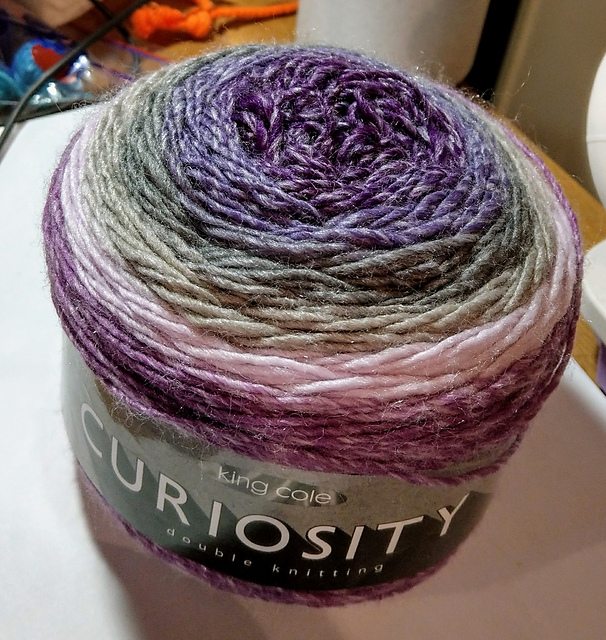
Identify the location of wooden floor. (277, 29).